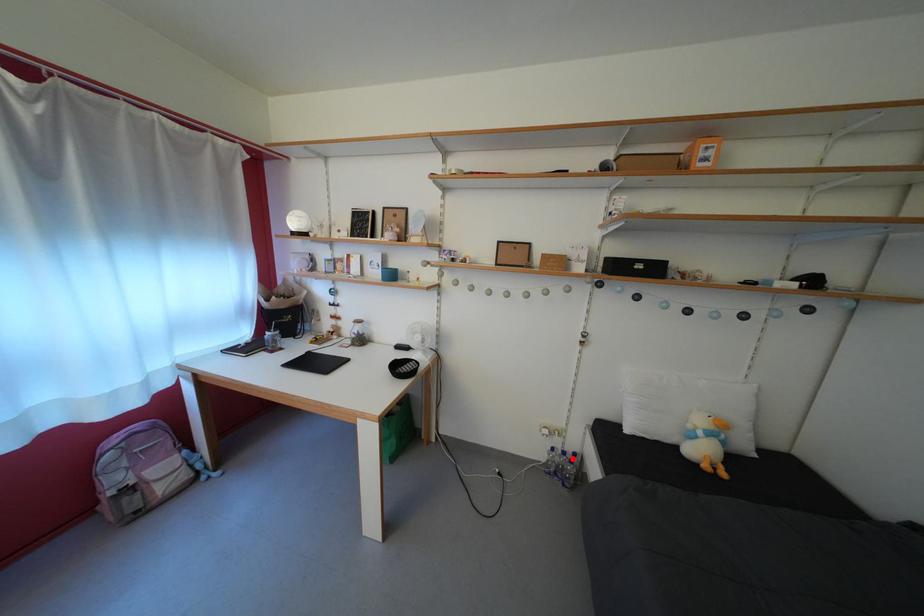
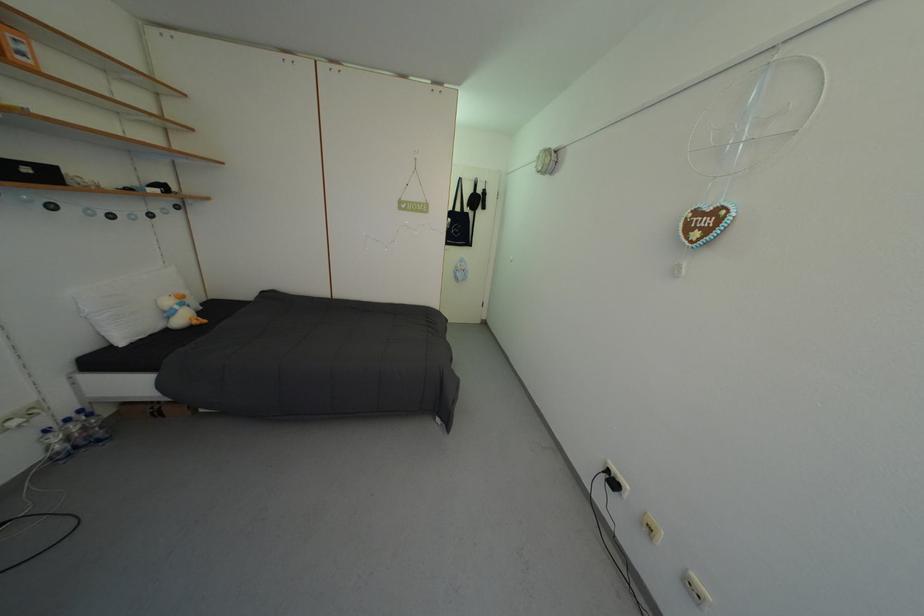
Question: I am providing you with two images of the same scene from different viewpoints. A red point is shown in image1. For the corresponding object point in image2, is it positioned nearer or farther from the camera?

Choices:
 (A) Nearer
 (B) Farther

Answer: (A)